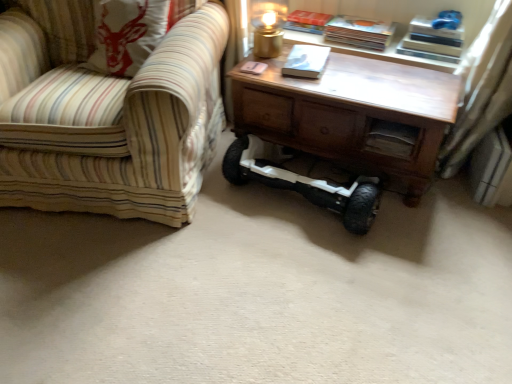
This screenshot has height=384, width=512. Identify the location of free point above hardcover book at upper center, which appears as the 1th book when viewed from the back (from a real-world perspective). (303, 14).